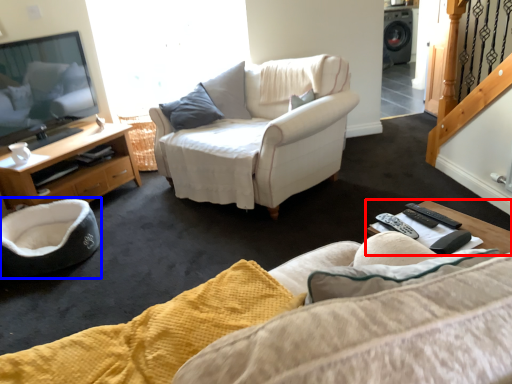
Question: Which of the following is the closest to the observer, coffee table (highlighted by a red box) or swivel chair (highlighted by a blue box)?

Choices:
 (A) coffee table
 (B) swivel chair

Answer: (A)